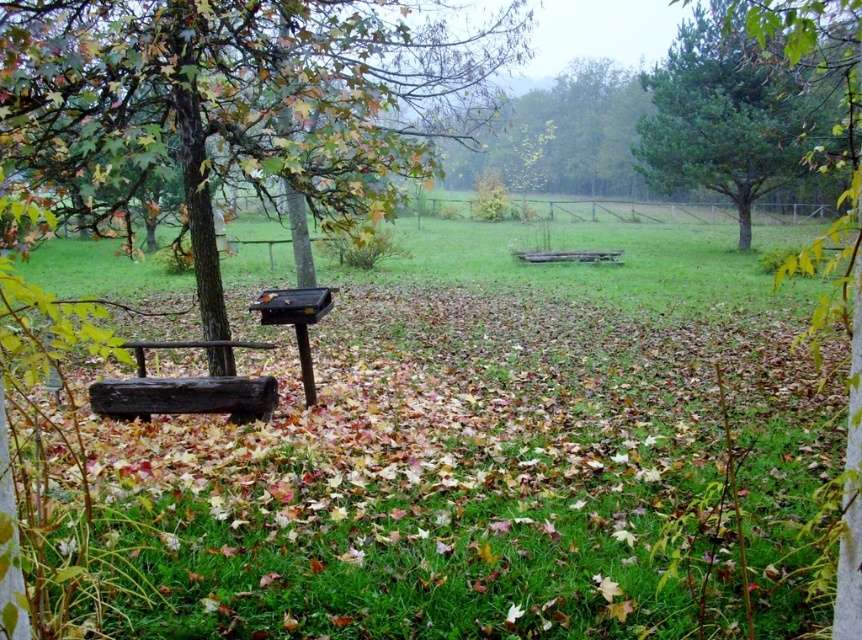
Question: Is brown textured tree trunk at left thinner than green pine tree at upper right?

Choices:
 (A) yes
 (B) no

Answer: (A)

Question: Considering the real-world distances, which object is closest to the green pine tree at upper right?

Choices:
 (A) dark brown wooden bench at left
 (B) brown textured tree trunk at left

Answer: (B)

Question: Which of the following is the closest to the observer?

Choices:
 (A) green pine tree at upper right
 (B) brown textured tree trunk at left
 (C) dark brown wooden bench at left

Answer: (A)

Question: Considering the relative positions of brown textured tree trunk at left and green pine tree at upper right in the image provided, where is brown textured tree trunk at left located with respect to green pine tree at upper right?

Choices:
 (A) above
 (B) below

Answer: (B)

Question: Does green pine tree at upper right have a greater width compared to dark brown wooden bench at left?

Choices:
 (A) no
 (B) yes

Answer: (B)

Question: Which point is closer to the camera?

Choices:
 (A) brown textured tree trunk at left
 (B) green pine tree at upper right

Answer: (B)